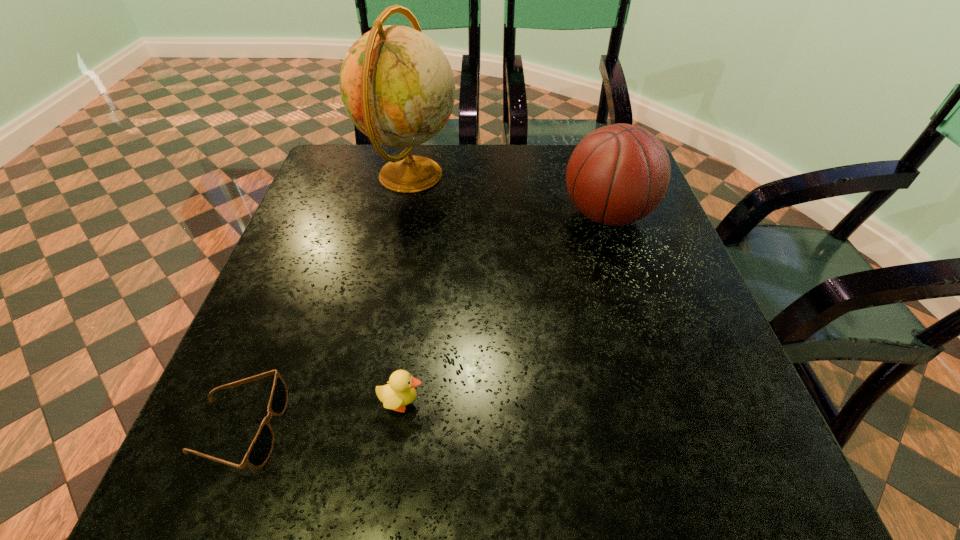
In order to click on free space between the shortest object and the basketball in this screenshot , I will do `click(423, 321)`.

Identify the location of vacant space that is in between the basketball and the globe. (509, 195).

Where is `vacant area between the duckling and the globe`? vacant area between the duckling and the globe is located at coordinates (406, 288).

Select which object appears as the third closest to the sunglasses. Please provide its 2D coordinates. Your answer should be formatted as a tuple, i.e. [(x, y)], where the tuple contains the x and y coordinates of a point satisfying the conditions above.

[(618, 174)]

Point out which object is positioned as the third nearest to the globe. Please provide its 2D coordinates. Your answer should be formatted as a tuple, i.e. [(x, y)], where the tuple contains the x and y coordinates of a point satisfying the conditions above.

[(400, 391)]

Where is `vacant point that satisfies the following two spatial constraints: 1. on the front side of the tallest object; 2. on the frames of the shortest object`? The width and height of the screenshot is (960, 540). vacant point that satisfies the following two spatial constraints: 1. on the front side of the tallest object; 2. on the frames of the shortest object is located at coordinates (360, 428).